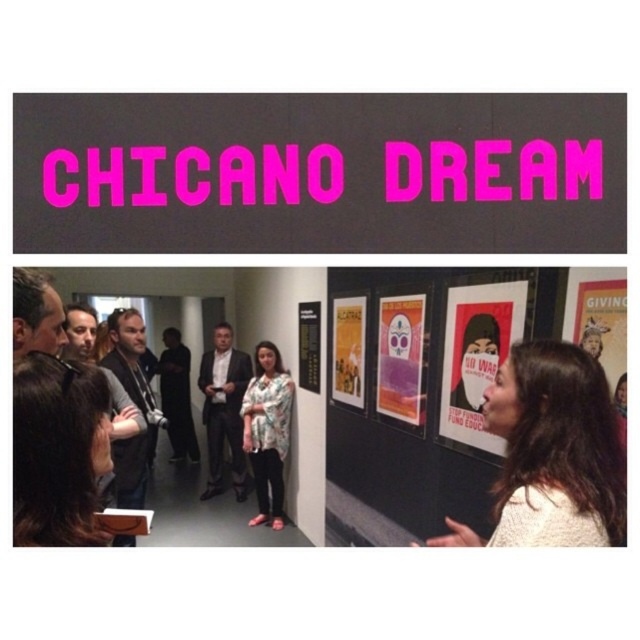
Question: Among these objects, which one is farthest from the camera?

Choices:
 (A) matte purple poster at center
 (B) floral shirt at center
 (C) matte white sweater at lower right
 (D) pink matte sign at upper center

Answer: (B)

Question: Can you confirm if floral shirt at center is thinner than matte paper poster at center?

Choices:
 (A) no
 (B) yes

Answer: (A)

Question: Which of the following is the closest to the observer?

Choices:
 (A) (486, 349)
 (B) (260, 417)

Answer: (A)

Question: Which point is closer to the camera?

Choices:
 (A) matte black poster at center
 (B) matte white sweater at lower right
 (C) gold metallic poster at center
 (D) matte purple poster at center

Answer: (B)

Question: Can you confirm if pink matte sign at upper center is smaller than matte white sweater at lower right?

Choices:
 (A) no
 (B) yes

Answer: (B)

Question: Can you confirm if pink matte sign at upper center is positioned to the right of matte white sweater at lower right?

Choices:
 (A) yes
 (B) no

Answer: (B)